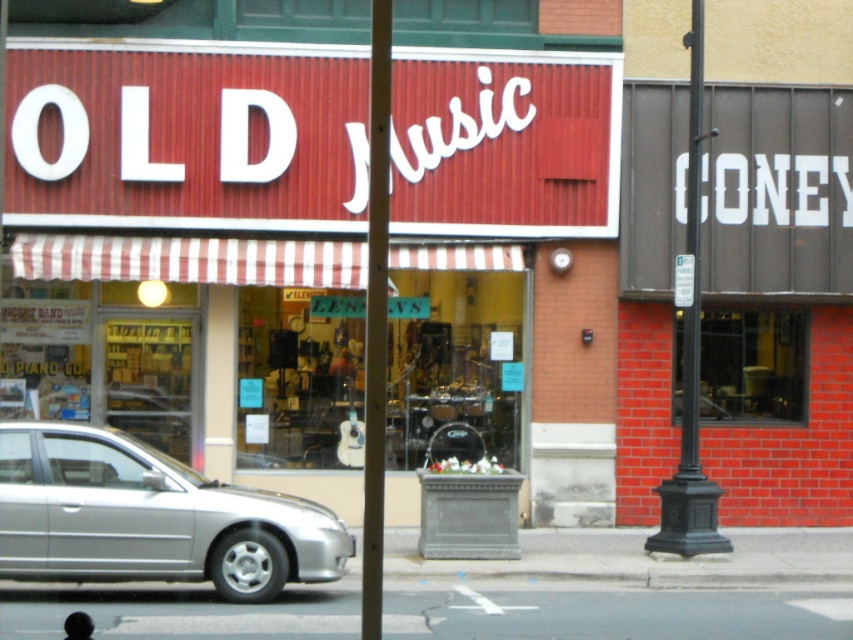
You are standing in front of the Old Music store and need to choose between the smooth wooden pole at center and the black metal pole at right to hang a banner. Which pole is taller and thus better suited for hanging a banner higher up?

The smooth wooden pole at center is taller than the black metal pole at right, so it is better suited for hanging the banner higher up.

You are a delivery person trying to park your 1.5 meter tall delivery robot in the street scene. The robot must be placed between the silver metallic car at lower left and the smooth wooden pole at center. Can the robot fit vertically between them?

The silver metallic car at lower left is shorter than the smooth wooden pole at center. Since the robot is 1.5 meters tall, it can fit vertically between them as long as the space between the two objects is at least 1.5 meters in height. However, the exact height of the space isn

You are a delivery person needing to park your delivery van, which is 3 meters long, near the silver metallic car at lower left and the black metal pole at right. Based on their sizes, can you estimate if there is enough space between them to park your van?

The silver metallic car at lower left is larger than the black metal pole at right. However, without knowing the exact distance between them, it is impossible to determine if there is enough space for a 3 meter van.